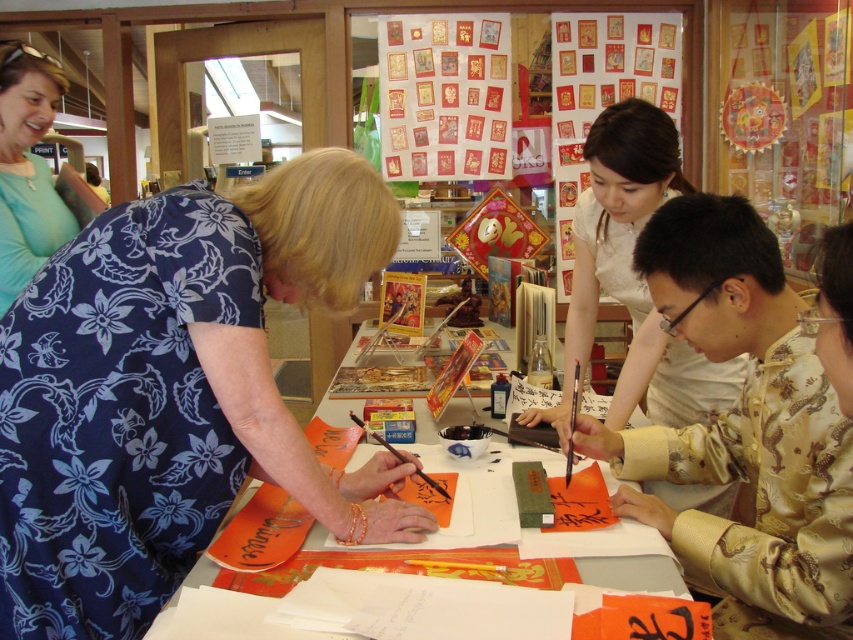
Question: Can you confirm if blue floral dress at center is positioned below white paper at center?

Choices:
 (A) no
 (B) yes

Answer: (A)

Question: Which point is closer to the camera?

Choices:
 (A) (22, 262)
 (B) (309, 474)
 (C) (461, 499)

Answer: (B)

Question: Among these objects, which one is farthest from the camera?

Choices:
 (A) blue floral dress at center
 (B) white paper at center
 (C) gold silk shirt at center
 (D) matte blue dress at upper left

Answer: (D)

Question: Is blue floral dress at center closer to camera compared to matte blue dress at upper left?

Choices:
 (A) yes
 (B) no

Answer: (A)

Question: Can you confirm if gold silk shirt at center is bigger than white silk blouse at center?

Choices:
 (A) yes
 (B) no

Answer: (B)

Question: Which object appears closest to the camera in this image?

Choices:
 (A) blue floral dress at center
 (B) gold silk shirt at center
 (C) matte blue dress at upper left

Answer: (A)